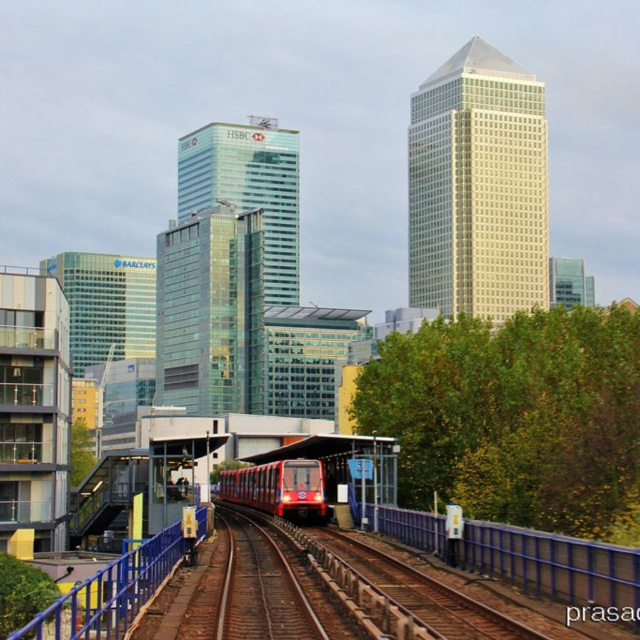
You are standing at the train station platform and want to reach a specific point marked at coordinates point (122,632). If your walking speed is 1.2 meters per second, how many seconds will it take you to reach that point?

The distance of point (122,632) from viewer is 14.96 meters. At a walking speed of 1.2 meters per second, it will take approximately 12.47 seconds to reach the point.

You are a passenger waiting on the platform and see the blue metallic rail at center and the blue metallic rail at lower left. Which one is smaller in size?

The blue metallic rail at center is smaller in size compared to the blue metallic rail at lower left.